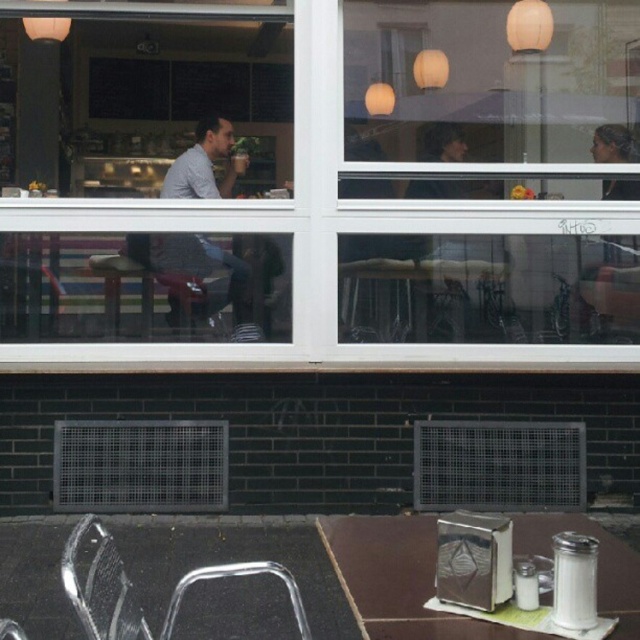
Between metallic silver napkin holder at center and matte gray shirt at left, which one appears on the right side from the viewer's perspective?

metallic silver napkin holder at center is more to the right.

Which is above, metallic silver napkin holder at center or matte gray shirt at left?

Positioned higher is matte gray shirt at left.

Describe the element at coordinates (396, 577) in the screenshot. The height and width of the screenshot is (640, 640). I see `metallic silver napkin holder at center` at that location.

At what (x,y) coordinates should I click in order to perform the action: click on metallic silver napkin holder at center. Please return your answer as a coordinate pair (x, y). Image resolution: width=640 pixels, height=640 pixels. Looking at the image, I should click on (396, 577).

Does matte gray shirt at left lie behind metallic silver chair at lower left?

Yes, matte gray shirt at left is behind metallic silver chair at lower left.

Between point (198, 266) and point (296, 586), which one is positioned behind?

The point (198, 266) is behind.

Locate an element on the screen. matte gray shirt at left is located at coordinates (202, 272).

At what (x,y) coordinates should I click in order to perform the action: click on matte gray shirt at left. Please return your answer as a coordinate pair (x, y). Looking at the image, I should click on (202, 272).

Can you confirm if metallic silver napkin holder at center is smaller than metallic silver chair at lower left?

Yes, metallic silver napkin holder at center is smaller than metallic silver chair at lower left.

Is metallic silver napkin holder at center positioned at the back of metallic silver chair at lower left?

Yes, it is.

Find the location of a particular element. This screenshot has height=640, width=640. metallic silver napkin holder at center is located at coordinates (396, 577).